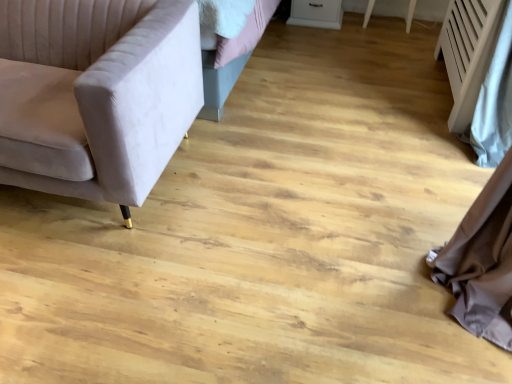
Question: From the image's perspective, would you say white textured radiator at right is positioned over white glossy drawer at upper center?

Choices:
 (A) yes
 (B) no

Answer: (B)

Question: From the image's perspective, does white textured radiator at right appear lower than white glossy drawer at upper center?

Choices:
 (A) yes
 (B) no

Answer: (A)

Question: From a real-world perspective, is white textured radiator at right physically above white glossy drawer at upper center?

Choices:
 (A) yes
 (B) no

Answer: (A)

Question: Is white textured radiator at right at the left side of white glossy drawer at upper center?

Choices:
 (A) no
 (B) yes

Answer: (A)

Question: Is white textured radiator at right smaller than white glossy drawer at upper center?

Choices:
 (A) yes
 (B) no

Answer: (B)

Question: From the image's perspective, is velvet beige couch at left above or below white textured radiator at right?

Choices:
 (A) below
 (B) above

Answer: (A)

Question: From a real-world perspective, is velvet beige couch at left above or below white textured radiator at right?

Choices:
 (A) above
 (B) below

Answer: (B)

Question: Is point (79, 115) positioned closer to the camera than point (454, 26)?

Choices:
 (A) farther
 (B) closer

Answer: (B)

Question: Would you say velvet beige couch at left is to the left or to the right of white textured radiator at right in the picture?

Choices:
 (A) right
 (B) left

Answer: (B)

Question: From their relative heights in the image, would you say velvet beige couch at left is taller or shorter than white glossy drawer at upper center?

Choices:
 (A) tall
 (B) short

Answer: (A)

Question: Is point (29, 26) positioned closer to the camera than point (307, 8)?

Choices:
 (A) closer
 (B) farther

Answer: (A)

Question: Choose the correct answer: Is velvet beige couch at left inside white glossy drawer at upper center or outside it?

Choices:
 (A) inside
 (B) outside

Answer: (B)

Question: Considering the positions of velvet beige couch at left and white glossy drawer at upper center in the image, is velvet beige couch at left wider or thinner than white glossy drawer at upper center?

Choices:
 (A) wide
 (B) thin

Answer: (A)

Question: From their relative heights in the image, would you say white textured radiator at right is taller or shorter than white glossy drawer at upper center?

Choices:
 (A) tall
 (B) short

Answer: (A)

Question: Is white textured radiator at right bigger or smaller than white glossy drawer at upper center?

Choices:
 (A) small
 (B) big

Answer: (B)